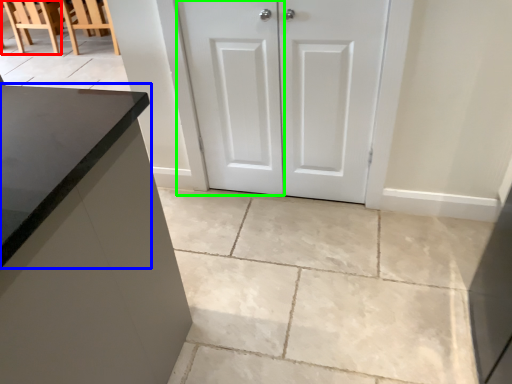
Question: Based on their relative distances, which object is nearer to chair (highlighted by a red box)? Choose from countertop (highlighted by a blue box) and screen door (highlighted by a green box).

Choices:
 (A) countertop
 (B) screen door

Answer: (B)